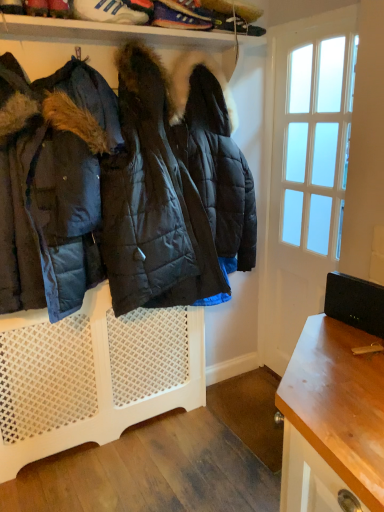
This screenshot has height=512, width=384. Find the location of `vacant space underneath white mesh radiator at center (from a real-world perspective)`. vacant space underneath white mesh radiator at center (from a real-world perspective) is located at coordinates (116, 436).